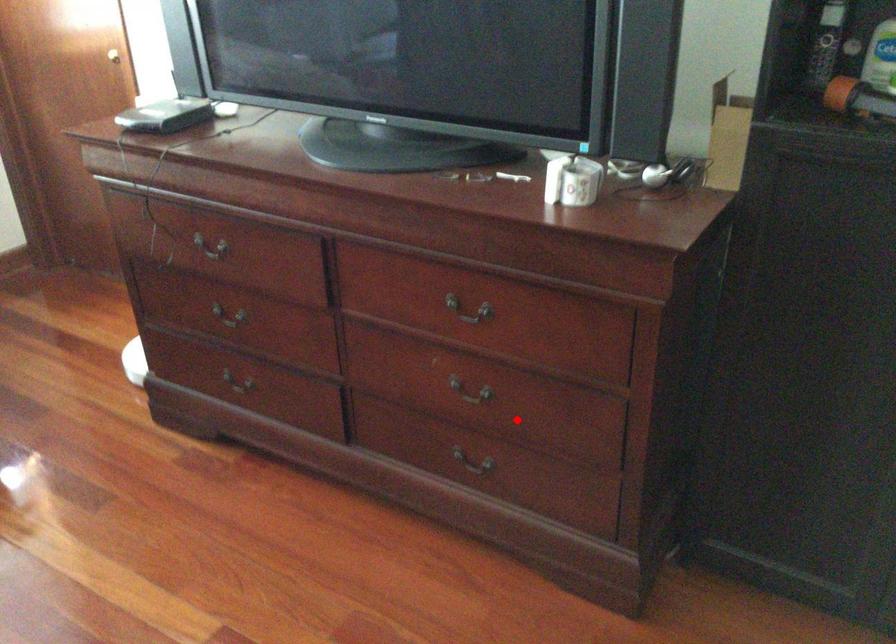
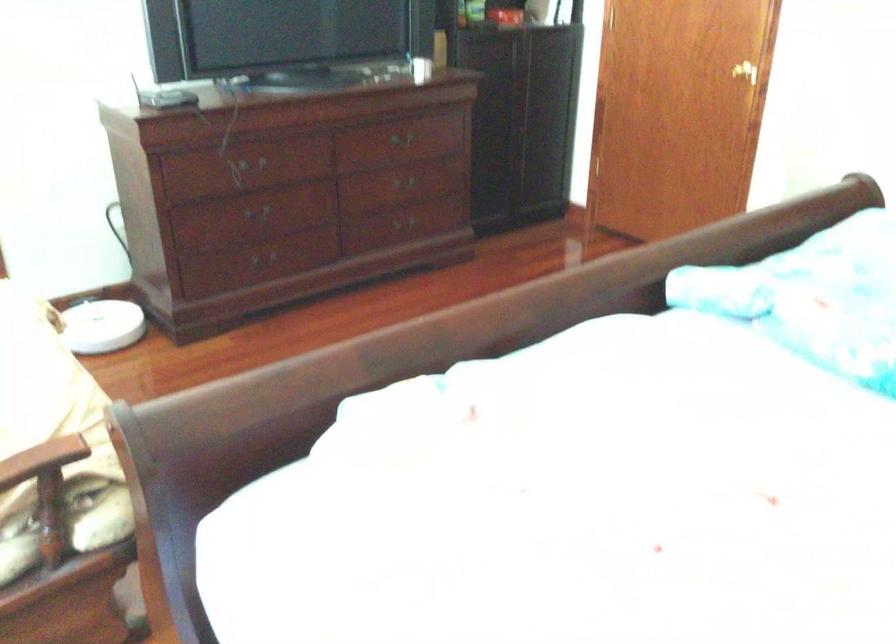
The point at the highlighted location is marked in the first image. Where is the corresponding point in the second image?

(409, 187)